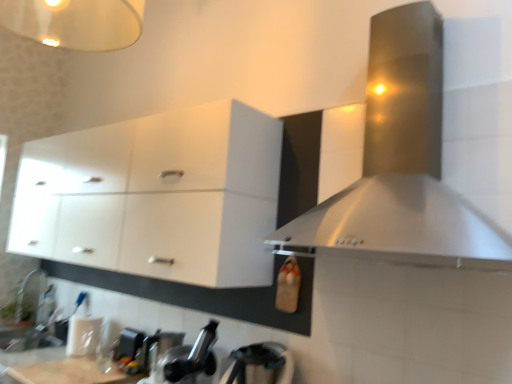
Question: Can you confirm if black matte faucet at lower center, the second appliance viewed from the back, is smaller than brushed metal faucet at lower left?

Choices:
 (A) no
 (B) yes

Answer: (A)

Question: From the image's perspective, is black matte faucet at lower center, the 2th appliance in the left-to-right sequence, on brushed metal faucet at lower left?

Choices:
 (A) yes
 (B) no

Answer: (A)

Question: Is black matte faucet at lower center, the 2th appliance in the left-to-right sequence, far from brushed metal faucet at lower left?

Choices:
 (A) yes
 (B) no

Answer: (A)

Question: From a real-world perspective, is black matte faucet at lower center, positioned as the second appliance in front-to-back order, located higher than brushed metal faucet at lower left?

Choices:
 (A) no
 (B) yes

Answer: (B)

Question: Is black matte faucet at lower center, the 2th appliance in the left-to-right sequence, thinner than brushed metal faucet at lower left?

Choices:
 (A) no
 (B) yes

Answer: (A)

Question: Is black matte faucet at lower center, the second appliance viewed from the back, further to the viewer compared to brushed metal faucet at lower left?

Choices:
 (A) yes
 (B) no

Answer: (B)

Question: Is white glossy sink at lower left aimed at black matte faucet at lower center, the second appliance viewed from the back?

Choices:
 (A) yes
 (B) no

Answer: (A)

Question: Does white glossy sink at lower left lie behind black matte faucet at lower center, acting as the second appliance starting from the right?

Choices:
 (A) no
 (B) yes

Answer: (B)

Question: Is white glossy sink at lower left outside of black matte faucet at lower center, positioned as the second appliance in front-to-back order?

Choices:
 (A) no
 (B) yes

Answer: (B)

Question: Considering the relative positions of white glossy sink at lower left and black matte faucet at lower center, acting as the second appliance starting from the right, in the image provided, is white glossy sink at lower left to the left of black matte faucet at lower center, acting as the second appliance starting from the right, from the viewer's perspective?

Choices:
 (A) yes
 (B) no

Answer: (A)

Question: Is white glossy sink at lower left looking in the opposite direction of black matte faucet at lower center, acting as the second appliance starting from the right?

Choices:
 (A) no
 (B) yes

Answer: (A)

Question: Considering the relative sizes of white glossy sink at lower left and black matte faucet at lower center, positioned as the second appliance in front-to-back order, in the image provided, is white glossy sink at lower left thinner than black matte faucet at lower center, positioned as the second appliance in front-to-back order,?

Choices:
 (A) no
 (B) yes

Answer: (A)

Question: Is brushed metal kettle at lower center, arranged as the 1th appliance when viewed from the right, surrounded by white glossy cabinet at upper left?

Choices:
 (A) yes
 (B) no

Answer: (B)